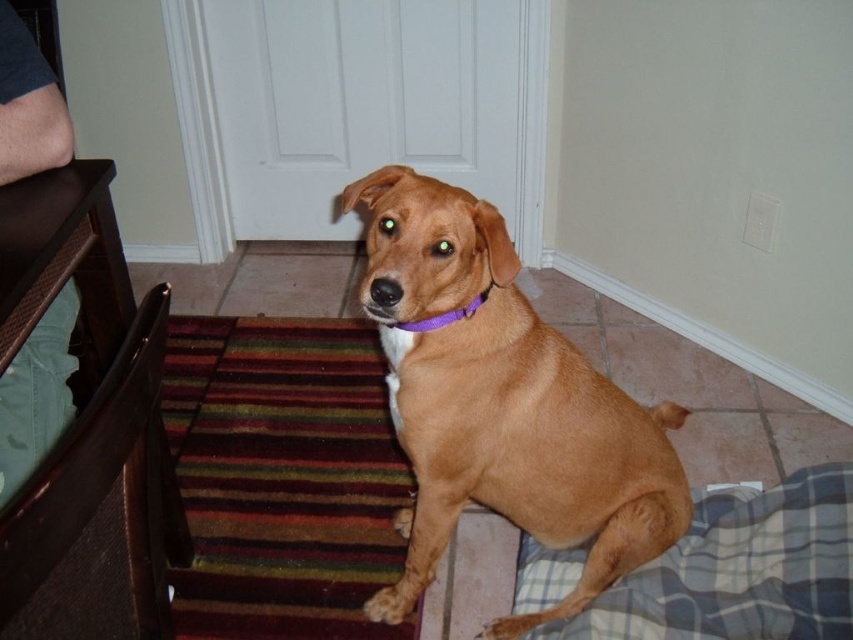
You are a service robot entering the room. You need to move from the door to the brown leather chair at lower left. Is the purple fabric neckband at center in your path?

The brown leather chair at lower left is to the left of purple fabric neckband at center, so the purple fabric neckband at center is in the path between the door and the brown leather chair at lower left. The robot should avoid it or move around it.

You are a dog owner who wants to buy a new dog bed for your brown matte dog at center. The store has a bed that is the same height as the brown leather chair at lower left. Will the bed be tall enough for your dog to rest comfortably?

The brown matte dog at center is much taller than the brown leather chair at lower left. Therefore, the bed with the same height as the brown leather chair at lower left will not be tall enough for the dog to rest comfortably.